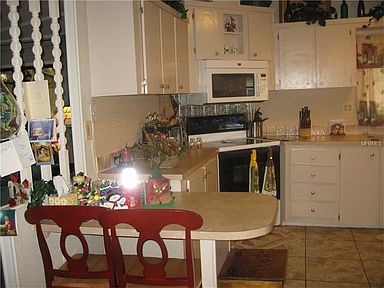
Locate an element on the screen. red wooden kitchen chair is located at coordinates pos(187,221).